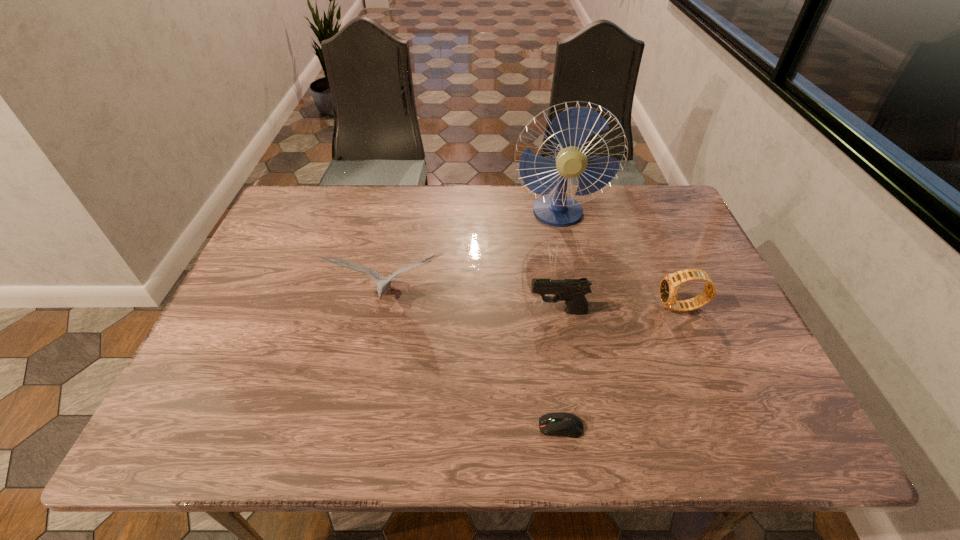
Locate an element on the screen. The height and width of the screenshot is (540, 960). free point between the rightmost object and the shortest object is located at coordinates (621, 367).

The height and width of the screenshot is (540, 960). I want to click on vacant area that lies between the farthest object and the pistol, so click(559, 263).

Find the location of a particular element. This screenshot has width=960, height=540. free space between the rightmost object and the shortest object is located at coordinates pyautogui.click(x=621, y=367).

Identify the location of vacant area that lies between the second tallest object and the shortest object. This screenshot has width=960, height=540. (474, 363).

What are the coordinates of `free space between the watch and the fourth shortest object` in the screenshot? It's located at (535, 303).

Image resolution: width=960 pixels, height=540 pixels. I want to click on vacant region between the shortest object and the watch, so click(621, 367).

At what (x,y) coordinates should I click in order to perform the action: click on empty space between the computer equipment and the rightmost object. Please return your answer as a coordinate pair (x, y). Image resolution: width=960 pixels, height=540 pixels. Looking at the image, I should click on (621, 367).

The height and width of the screenshot is (540, 960). Find the location of `object that stands as the third closest to the rightmost object`. object that stands as the third closest to the rightmost object is located at coordinates (566, 424).

You are a GUI agent. You are given a task and a screenshot of the screen. Output one action in this format:
    pyautogui.click(x=<x>, y=<y>)
    Task: Click on the closest object relative to the gull
    
    Given the screenshot: What is the action you would take?
    pyautogui.click(x=572, y=291)

This screenshot has height=540, width=960. I want to click on free spot that satisfies the following two spatial constraints: 1. at the front of the fan where the blades are visible; 2. on the button of the computer equipment, so click(x=602, y=427).